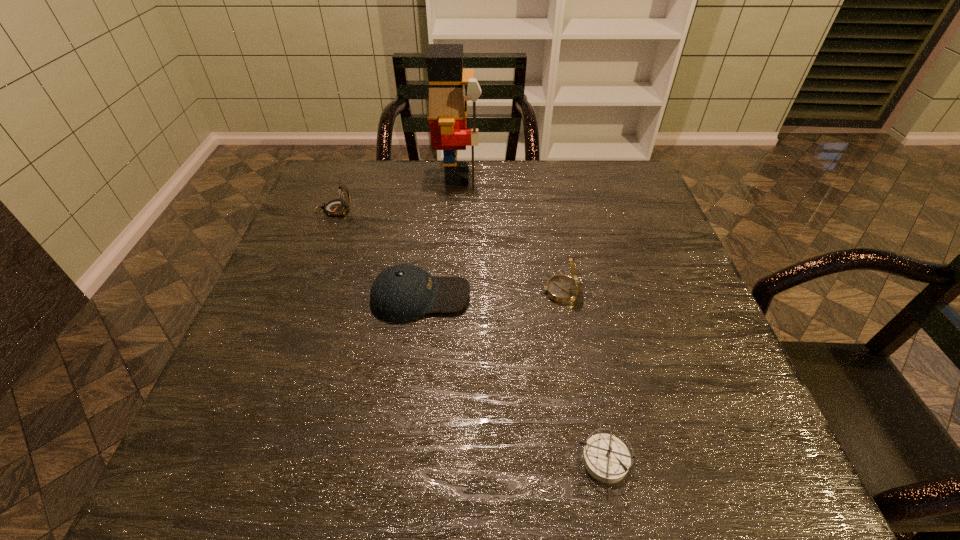
This screenshot has width=960, height=540. Find the location of `nutcracker`. nutcracker is located at coordinates (448, 109).

You are a GUI agent. You are given a task and a screenshot of the screen. Output one action in this format:
    pyautogui.click(x=<x>, y=<y>)
    Task: Click on the farthest object
    The width and height of the screenshot is (960, 540).
    Given the screenshot: What is the action you would take?
    pyautogui.click(x=448, y=109)

Identify the location of the leftmost compass. The height and width of the screenshot is (540, 960). (336, 207).

Where is `the farthest compass`? The image size is (960, 540). the farthest compass is located at coordinates (336, 207).

In order to click on the second nearest compass in this screenshot , I will do `click(563, 289)`.

Locate an element on the screen. The height and width of the screenshot is (540, 960). baseball cap is located at coordinates point(401,293).

Where is `the shortest compass`? the shortest compass is located at coordinates click(606, 458).

Locate an element on the screen. Image resolution: width=960 pixels, height=540 pixels. the nearest compass is located at coordinates pyautogui.click(x=606, y=458).

The height and width of the screenshot is (540, 960). Identify the location of free space located 0.240m in front of the tallest object holding the staff. (562, 176).

Find the location of a particular element. The image size is (960, 540). free space located on the face of the second farthest object is located at coordinates (499, 210).